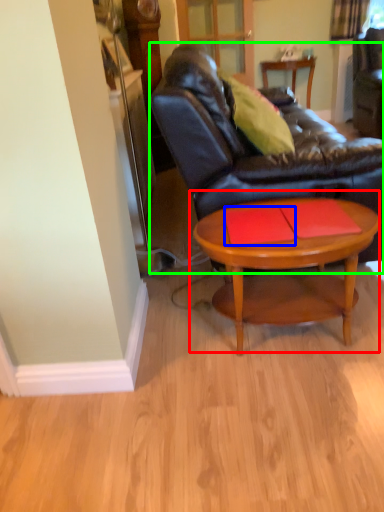
Question: Which object is positioned closest to coffee table (highlighted by a red box)? Select from plank (highlighted by a blue box) and studio couch (highlighted by a green box).

Choices:
 (A) plank
 (B) studio couch

Answer: (A)